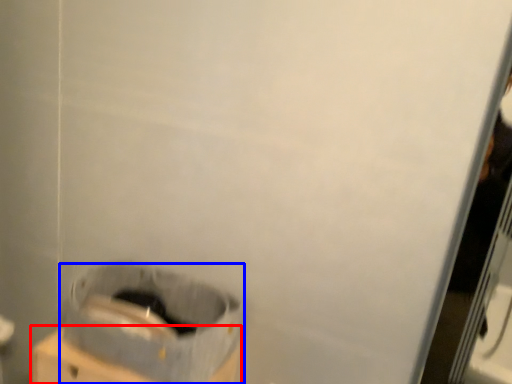
Question: Among these objects, which one is farthest to the camera, cardboard box (highlighted by a red box) or waste container (highlighted by a blue box)?

Choices:
 (A) cardboard box
 (B) waste container

Answer: (A)